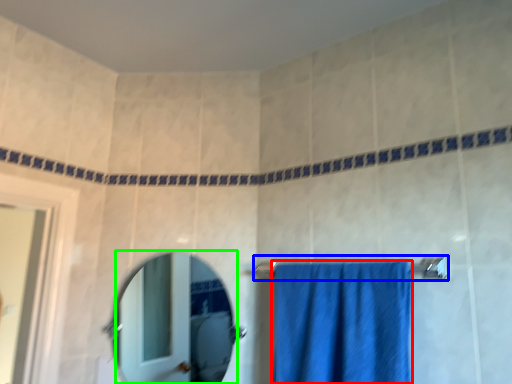
Question: Estimate the real-world distances between objects in this image. Which object is closer to towel (highlighted by a red box), towel bar (highlighted by a blue box) or mirror (highlighted by a green box)?

Choices:
 (A) towel bar
 (B) mirror

Answer: (A)